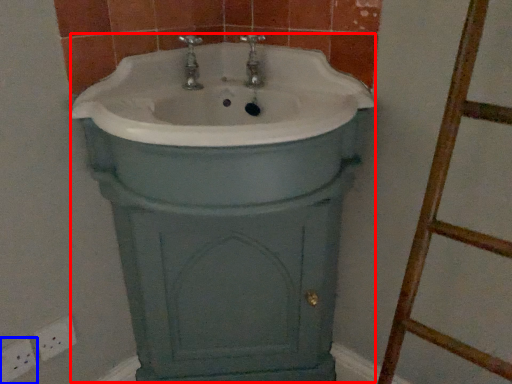
Question: Which object is closer to the camera taking this photo, porcelain (highlighted by a red box) or electric outlet (highlighted by a blue box)?

Choices:
 (A) porcelain
 (B) electric outlet

Answer: (A)